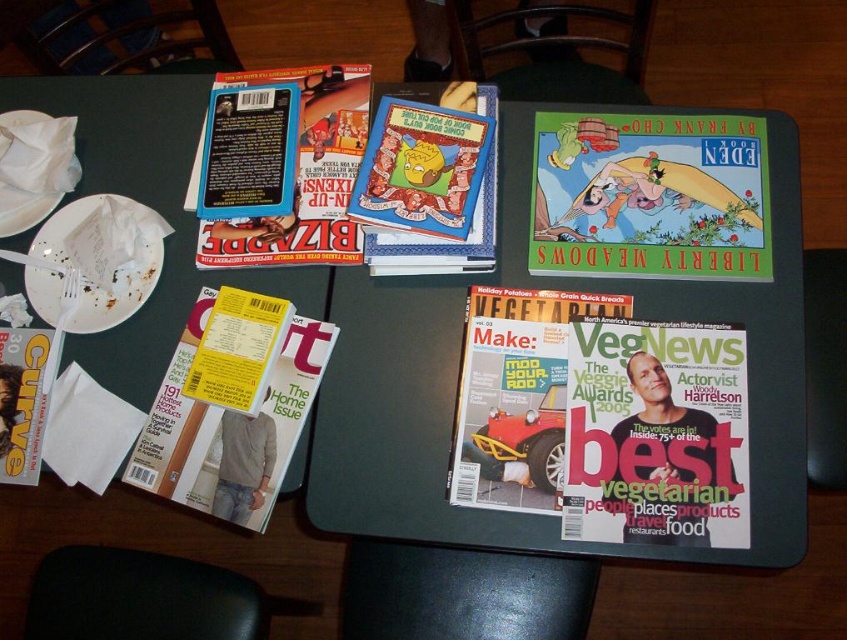
Can you confirm if hardcover comic book at center is positioned below matte yellow magazine at lower left?

No, hardcover comic book at center is not below matte yellow magazine at lower left.

This screenshot has height=640, width=847. What do you see at coordinates (650, 196) in the screenshot? I see `hardcover comic book at center` at bounding box center [650, 196].

Image resolution: width=847 pixels, height=640 pixels. In order to click on hardcover comic book at center in this screenshot , I will do `click(650, 196)`.

Is hardcover comic book at center shorter than matte paper magazine at center?

Yes.

Between hardcover comic book at center and matte paper magazine at center, which one has less height?

Standing shorter between the two is hardcover comic book at center.

Is point (657, 160) farther from camera compared to point (475, 300)?

Yes, point (657, 160) is farther from viewer.

The height and width of the screenshot is (640, 847). Identify the location of hardcover comic book at center. (650, 196).

Is matte blue book at upper left in front of cartoonish paper book at center?

No.

In the scene shown: Does matte blue book at upper left have a greater width compared to cartoonish paper book at center?

Indeed, matte blue book at upper left has a greater width compared to cartoonish paper book at center.

Where is `matte blue book at upper left`? The image size is (847, 640). matte blue book at upper left is located at coordinates (303, 177).